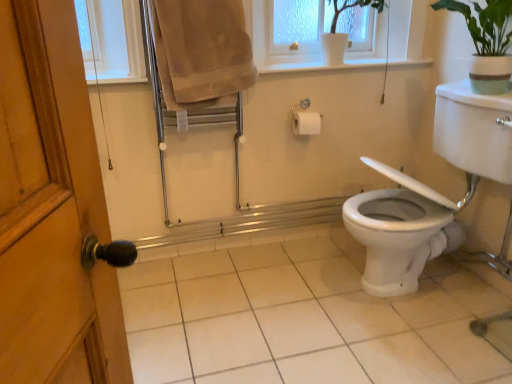
Question: Does beige cotton towel at upper center have a smaller size compared to white glossy sink at right?

Choices:
 (A) no
 (B) yes

Answer: (B)

Question: From the image's perspective, does beige cotton towel at upper center appear higher than white glossy sink at right?

Choices:
 (A) no
 (B) yes

Answer: (B)

Question: Considering the relative sizes of beige cotton towel at upper center and white glossy sink at right in the image provided, is beige cotton towel at upper center wider than white glossy sink at right?

Choices:
 (A) yes
 (B) no

Answer: (B)

Question: Considering the relative positions of beige cotton towel at upper center and white glossy sink at right in the image provided, is beige cotton towel at upper center in front of white glossy sink at right?

Choices:
 (A) no
 (B) yes

Answer: (A)

Question: Is beige cotton towel at upper center turned away from white glossy sink at right?

Choices:
 (A) no
 (B) yes

Answer: (A)

Question: Considering the positions of beige cotton towel at upper center and white glossy sink at right in the image, is beige cotton towel at upper center taller or shorter than white glossy sink at right?

Choices:
 (A) tall
 (B) short

Answer: (B)

Question: In terms of width, does beige cotton towel at upper center look wider or thinner when compared to white glossy sink at right?

Choices:
 (A) wide
 (B) thin

Answer: (B)

Question: Considering their positions, is beige cotton towel at upper center located in front of or behind white glossy sink at right?

Choices:
 (A) behind
 (B) front

Answer: (A)

Question: From a real-world perspective, is beige cotton towel at upper center physically located above or below white glossy sink at right?

Choices:
 (A) above
 (B) below

Answer: (A)

Question: Looking at the image, does white ceramic pot at upper center seem bigger or smaller compared to beige cotton towel at upper center?

Choices:
 (A) big
 (B) small

Answer: (B)

Question: In the image, is white ceramic pot at upper center positioned in front of or behind beige cotton towel at upper center?

Choices:
 (A) behind
 (B) front

Answer: (A)

Question: Choose the correct answer: Is white ceramic pot at upper center inside beige cotton towel at upper center or outside it?

Choices:
 (A) outside
 (B) inside

Answer: (A)

Question: From a real-world perspective, is white ceramic pot at upper center physically located above or below beige cotton towel at upper center?

Choices:
 (A) below
 (B) above

Answer: (B)

Question: In terms of height, does white glossy sink at right look taller or shorter compared to beige cotton towel at upper center?

Choices:
 (A) short
 (B) tall

Answer: (B)

Question: In the image, is white glossy sink at right positioned in front of or behind beige cotton towel at upper center?

Choices:
 (A) front
 (B) behind

Answer: (A)